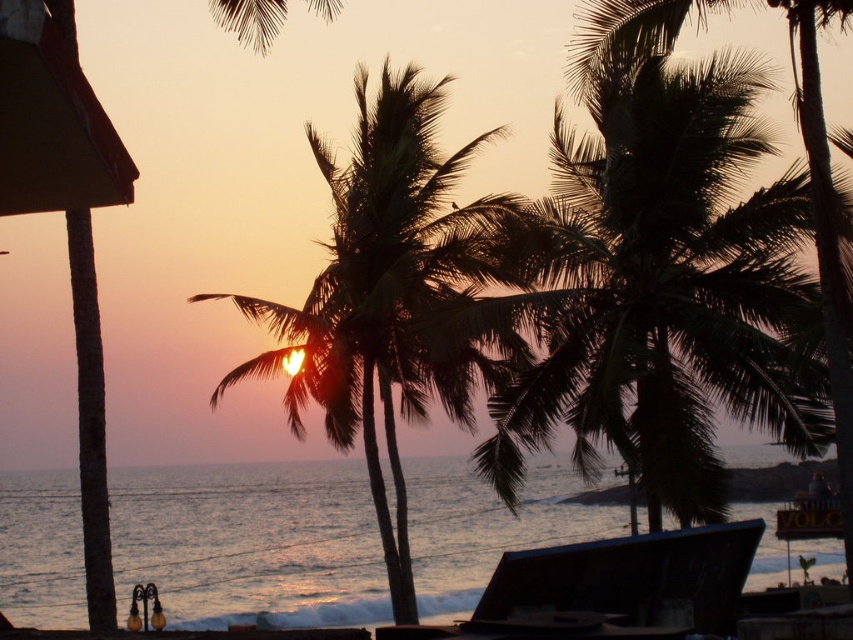
You are standing at the beach and see two points marked in the image. The first point is located at coordinates point [585,204] and the second at point [332,342]. Which point is closer to you?

Point [585,204] is further to the camera than point [332,342], so the point closer to you is point [332,342].

You are standing at the center of the beach looking towards the sunset. There is a dark green leafy palm tree at center. Can you see the palm tree in your line of sight?

Yes, the dark green leafy palm tree at center is located at point (665, 289), which is directly in front of you, so it is within your line of sight.